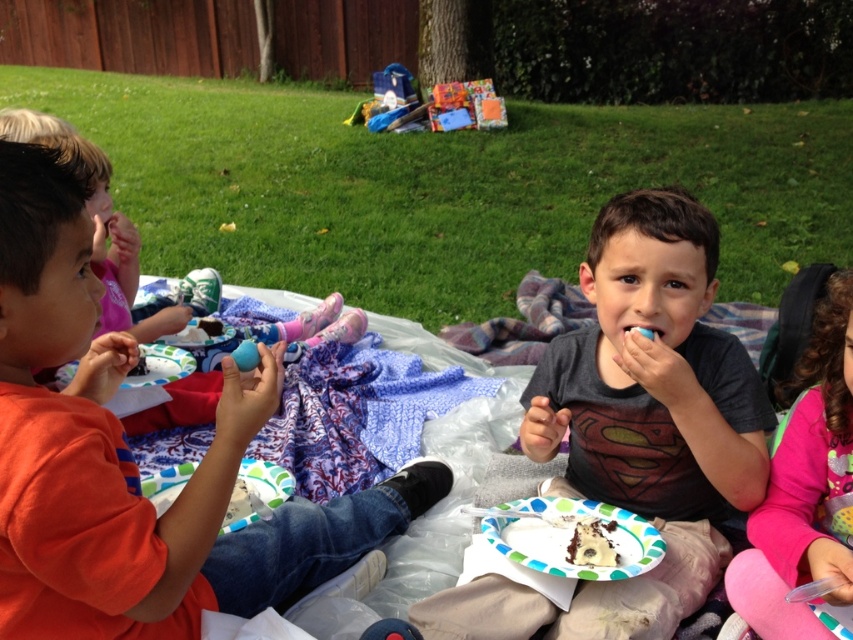
Question: Which of the following is the farthest from the observer?

Choices:
 (A) chocolate cake at center
 (B) pink fleece sweater at lower right

Answer: (A)

Question: Which is farther from the dark gray t-shirt at center?

Choices:
 (A) green grass at center
 (B) chocolate cake at center
 (C) orange cotton shirt at left
 (D) pink fleece sweater at lower right

Answer: (A)

Question: Observing the image, what is the correct spatial positioning of orange cotton shirt at left in reference to dark gray t-shirt at center?

Choices:
 (A) left
 (B) right

Answer: (A)

Question: Among these objects, which one is farthest from the camera?

Choices:
 (A) dark gray t-shirt at center
 (B) pink fleece sweater at lower right

Answer: (A)

Question: Is orange cotton shirt at left behind chocolate cake at center?

Choices:
 (A) no
 (B) yes

Answer: (A)

Question: In this image, where is green grass at center located relative to orange cotton shirt at left?

Choices:
 (A) right
 (B) left

Answer: (B)